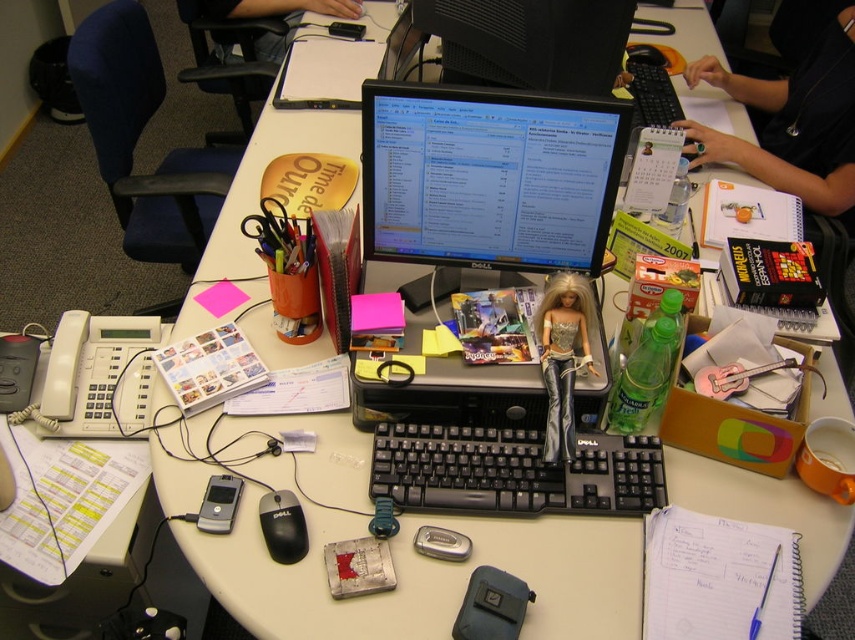
Please describe the position of the black glossy monitor at upper center in terms of coordinates on the desk surface. The desk surface is represented as a coordinate system where the bottom left corner is the origin point. The x and y axes increase to the right and upwards respectively. The coordinates are normalized between 0 and 1. Please provide the coordinates as a pair of numbers separated by a comma.

The black glossy monitor at upper center is located at coordinates approximately (528, 42) on the desk surface.

You are organizing the desk and need to place both the black plastic keyboard at center and the silver metallic cell phone at center into a drawer. The drawer has a height limit of 10 cm. Which item might not fit due to its height?

The black plastic keyboard at center is much taller than the silver metallic cell phone at center, so it might not fit into the drawer with a 10 cm height limit.